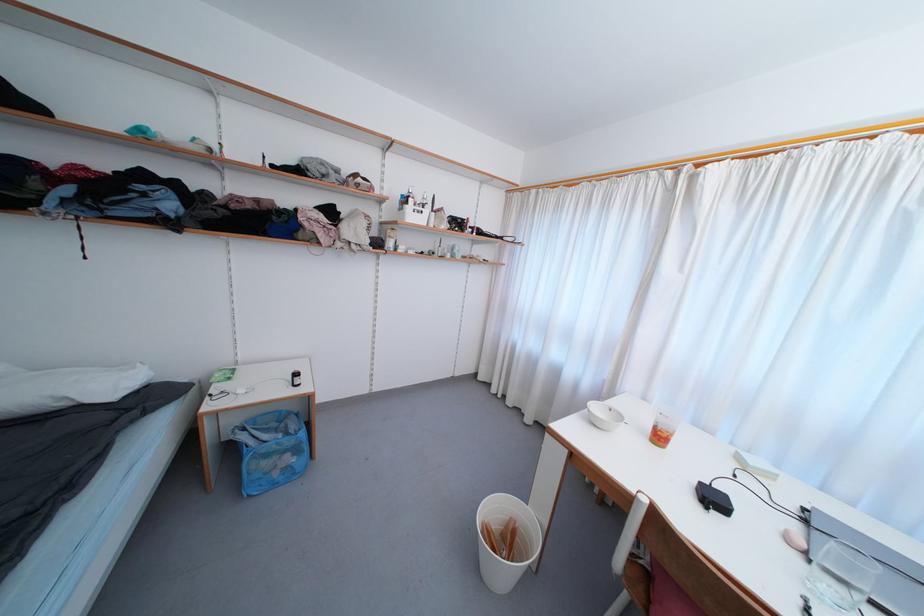
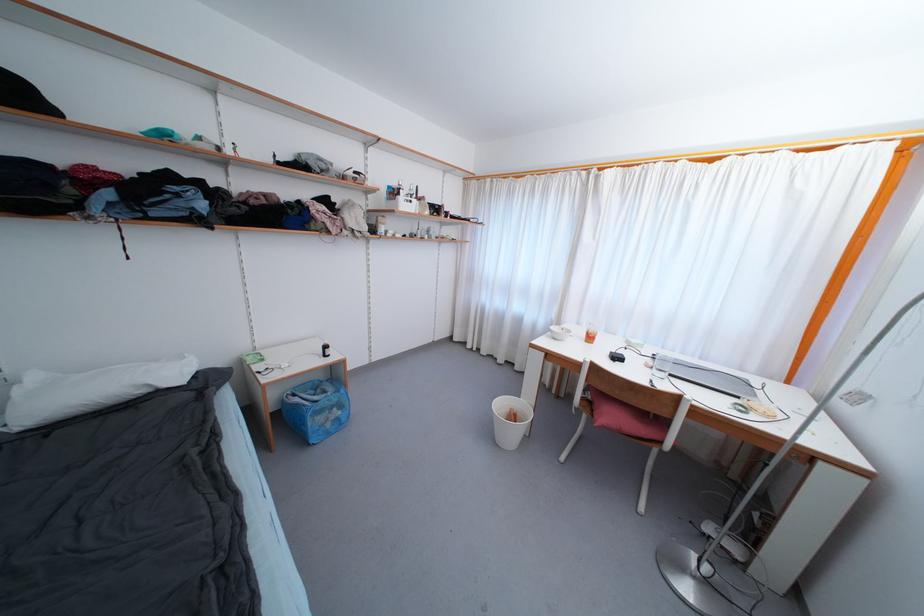
Locate, in the second image, the point that corresponds to (663,440) in the first image.

(593, 341)